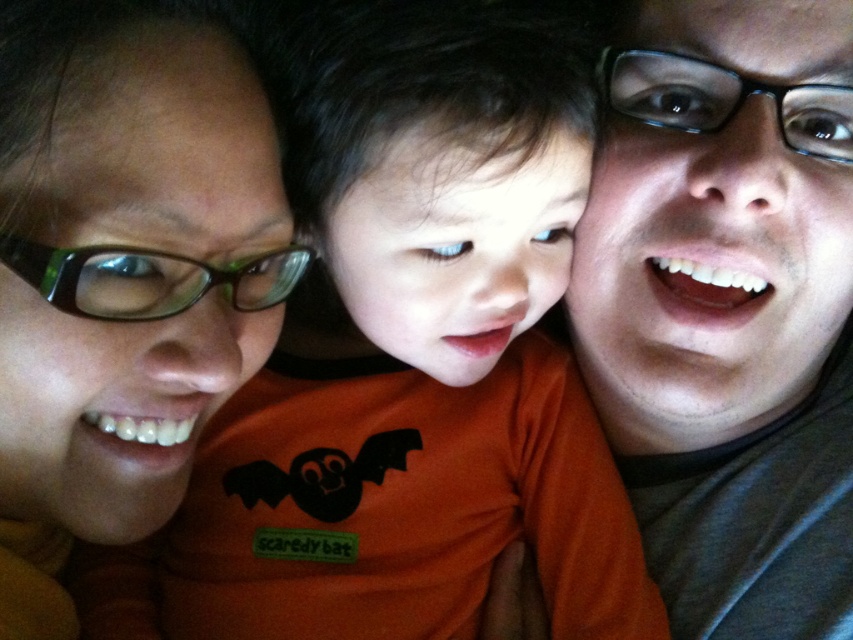
Is orange matte shirt at center positioned at the back of matte orange shirt at center?

Yes, it is.

Describe the element at coordinates (409, 376) in the screenshot. The width and height of the screenshot is (853, 640). I see `orange matte shirt at center` at that location.

The image size is (853, 640). I want to click on orange matte shirt at center, so click(409, 376).